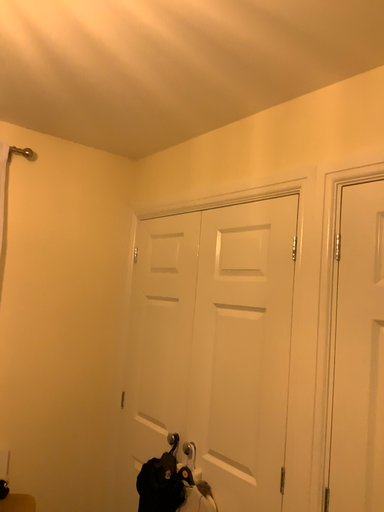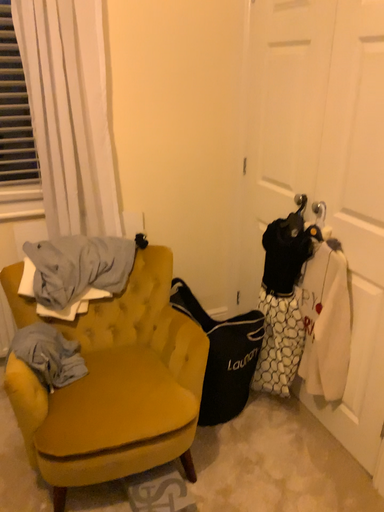
Question: Which way did the camera rotate in the video?

Choices:
 (A) rotated downward
 (B) rotated upward

Answer: (A)